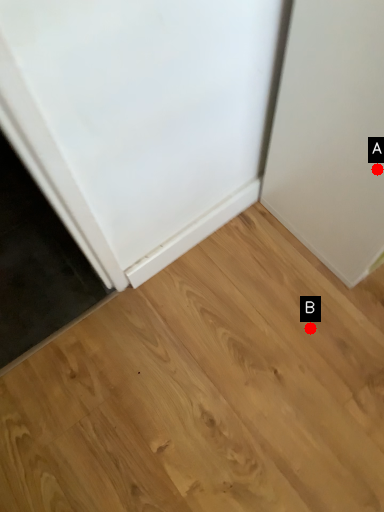
Question: Two points are circled on the image, labeled by A and B beside each circle. Which point is closer to the camera?

Choices:
 (A) A is closer
 (B) B is closer

Answer: (A)